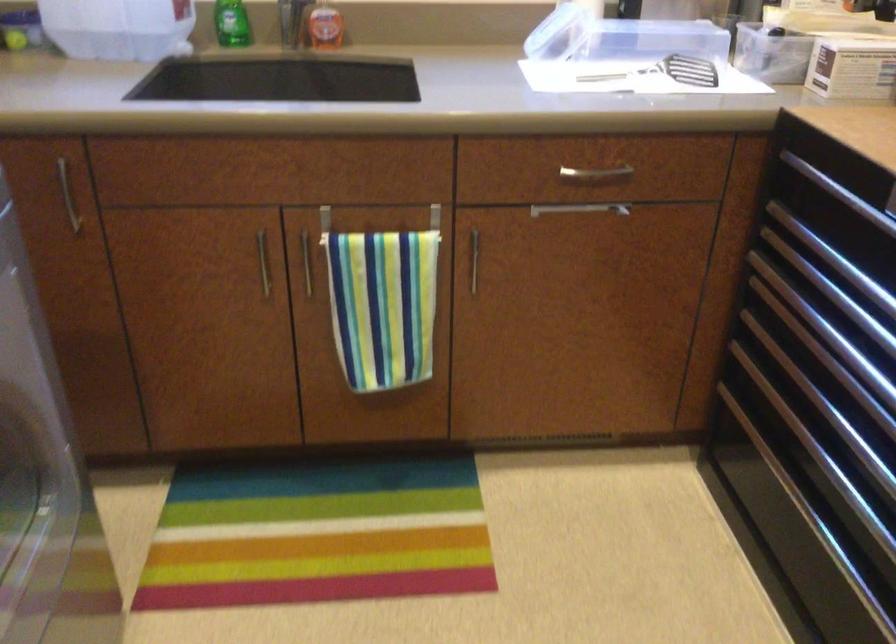
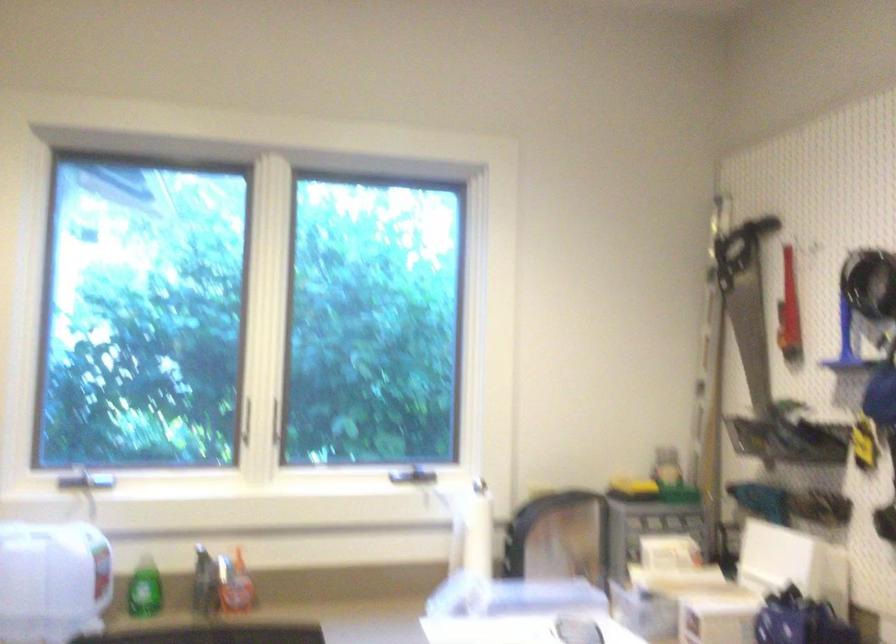
Question: The images are taken continuously from a first-person perspective. In which direction is your viewpoint rotating?

Choices:
 (A) Left
 (B) Right
 (C) Up
 (D) Down

Answer: (C)